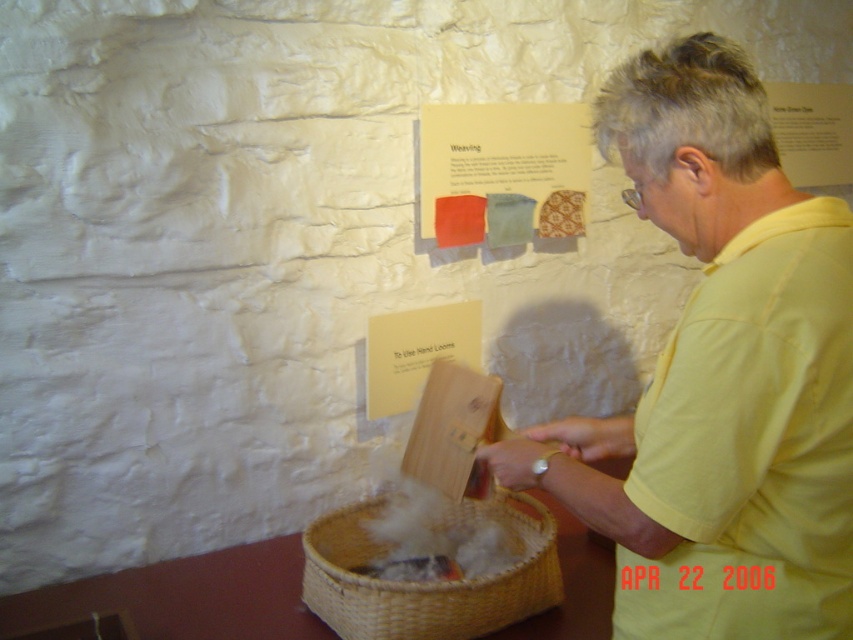
Question: Does yellow cotton shirt at center have a smaller size compared to matte paper poster at upper center?

Choices:
 (A) yes
 (B) no

Answer: (B)

Question: Does yellow cotton shirt at center appear on the left side of woven straw basket at lower center?

Choices:
 (A) no
 (B) yes

Answer: (A)

Question: Which object is closer to the camera taking this photo?

Choices:
 (A) yellow cotton shirt at center
 (B) matte paper poster at upper center

Answer: (A)

Question: Which object is closer to the camera taking this photo?

Choices:
 (A) yellow cotton shirt at center
 (B) matte brown paper at upper right
 (C) white paper at upper center
 (D) matte paper poster at upper center

Answer: (A)

Question: Can you confirm if woven straw basket at lower center is positioned to the right of white paper at upper center?

Choices:
 (A) yes
 (B) no

Answer: (A)

Question: Estimate the real-world distances between objects in this image. Which object is closer to the yellow cotton shirt at center?

Choices:
 (A) white paper at upper center
 (B) matte brown paper at upper right
 (C) woven straw basket at lower center
 (D) matte paper poster at upper center

Answer: (C)